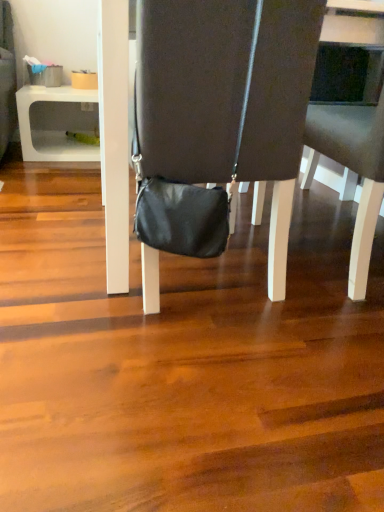
Measure the distance between white plastic table at lower left and camera.

The distance of white plastic table at lower left from camera is 7.23 feet.

What is the approximate height of white plastic table at lower left?

It is 15.27 inches.

This screenshot has width=384, height=512. I want to click on dark gray fabric chair at center, acting as the 2th chair starting from the left, so click(x=352, y=170).

Which is more to the left, dark gray fabric chair at center, acting as the 2th chair starting from the left, or matte black bag at center, the 2th chair positioned from the right?

matte black bag at center, the 2th chair positioned from the right, is more to the left.

From the picture: Is dark gray fabric chair at center, acting as the 2th chair starting from the left, positioned with its back to matte black bag at center, the 2th chair positioned from the right?

No.

Is point (256, 209) in front of point (232, 38)?

No, (256, 209) is further to viewer.

From the image's perspective, is dark gray fabric chair at center, the first chair from the right, beneath matte black bag at center, marked as the first chair in a left-to-right arrangement?

No, from the image's perspective, dark gray fabric chair at center, the first chair from the right, is not beneath matte black bag at center, marked as the first chair in a left-to-right arrangement.

In the scene shown: Which is closer, (33, 160) or (323, 31)?

Point (33, 160) appears to be farther away from the viewer than point (323, 31).

Could you tell me if white plastic table at lower left is facing dark gray fabric chair at center, acting as the 2th chair starting from the left?

No, white plastic table at lower left is not aimed at dark gray fabric chair at center, acting as the 2th chair starting from the left.

Is white plastic table at lower left positioned far away from dark gray fabric chair at center, acting as the 2th chair starting from the left?

Yes, white plastic table at lower left and dark gray fabric chair at center, acting as the 2th chair starting from the left, are quite far apart.

Where is `table below the dark gray fabric chair at center, acting as the 2th chair starting from the left (from a real-world perspective)`? The height and width of the screenshot is (512, 384). table below the dark gray fabric chair at center, acting as the 2th chair starting from the left (from a real-world perspective) is located at coordinates (56, 123).

In the scene shown: What's the angular difference between dark gray fabric chair at center, acting as the 2th chair starting from the left, and white plastic table at lower left's facing directions?

180 degrees separate the facing orientations of dark gray fabric chair at center, acting as the 2th chair starting from the left, and white plastic table at lower left.

From a real-world perspective, which object stands above the other?

dark gray fabric chair at center, the first chair from the right, from a real-world perspective.

In the scene shown: From the image's perspective, is dark gray fabric chair at center, acting as the 2th chair starting from the left, located above white plastic table at lower left?

Incorrect, from the image's perspective, dark gray fabric chair at center, acting as the 2th chair starting from the left, is lower than white plastic table at lower left.

Does dark gray fabric chair at center, the first chair from the right, have a greater width compared to white plastic table at lower left?

No, dark gray fabric chair at center, the first chair from the right, is not wider than white plastic table at lower left.

Is matte black bag at center, the 2th chair positioned from the right, situated inside white plastic table at lower left or outside?

matte black bag at center, the 2th chair positioned from the right, lies outside white plastic table at lower left.

Between matte black bag at center, marked as the first chair in a left-to-right arrangement, and white plastic table at lower left, which one has larger width?

white plastic table at lower left.

From a real-world perspective, is matte black bag at center, marked as the first chair in a left-to-right arrangement, positioned above or below white plastic table at lower left?

In terms of real-world spatial position, matte black bag at center, marked as the first chair in a left-to-right arrangement, is above white plastic table at lower left.

Is matte black bag at center, the 2th chair positioned from the right, oriented away from white plastic table at lower left?

matte black bag at center, the 2th chair positioned from the right, does not have its back to white plastic table at lower left.

Consider the image. From the image's perspective, would you say matte black bag at center, marked as the first chair in a left-to-right arrangement, is shown under dark gray fabric chair at center, acting as the 2th chair starting from the left?

Correct, matte black bag at center, marked as the first chair in a left-to-right arrangement, appears lower than dark gray fabric chair at center, acting as the 2th chair starting from the left, in the image.

Is matte black bag at center, the 2th chair positioned from the right, bigger or smaller than dark gray fabric chair at center, acting as the 2th chair starting from the left?

matte black bag at center, the 2th chair positioned from the right, is bigger than dark gray fabric chair at center, acting as the 2th chair starting from the left.

From a real-world perspective, is matte black bag at center, the 2th chair positioned from the right, positioned under dark gray fabric chair at center, acting as the 2th chair starting from the left, based on gravity?

Yes, from a real-world perspective, matte black bag at center, the 2th chair positioned from the right, is beneath dark gray fabric chair at center, acting as the 2th chair starting from the left.

Does white plastic table at lower left contain matte black bag at center, marked as the first chair in a left-to-right arrangement?

No, matte black bag at center, marked as the first chair in a left-to-right arrangement, is located outside of white plastic table at lower left.

In order to click on table behind the matte black bag at center, marked as the first chair in a left-to-right arrangement in this screenshot , I will do `click(56, 123)`.

Is white plastic table at lower left shorter than matte black bag at center, the 2th chair positioned from the right?

Yes, white plastic table at lower left is shorter than matte black bag at center, the 2th chair positioned from the right.

From the image's perspective, which is below, white plastic table at lower left or matte black bag at center, marked as the first chair in a left-to-right arrangement?

matte black bag at center, marked as the first chair in a left-to-right arrangement, appears lower in the image.

What are the coordinates of `chair below the dark gray fabric chair at center, the first chair from the right (from a real-world perspective)` in the screenshot? It's located at pos(217,122).

Where is `chair that is the 2nd object to the right of the white plastic table at lower left, starting at the anchor`? This screenshot has height=512, width=384. chair that is the 2nd object to the right of the white plastic table at lower left, starting at the anchor is located at coordinates (352, 170).

From the image, which object appears to be farther from white plastic table at lower left, dark gray fabric chair at center, acting as the 2th chair starting from the left, or matte black bag at center, the 2th chair positioned from the right?

Based on the image, dark gray fabric chair at center, acting as the 2th chair starting from the left, appears to be further to white plastic table at lower left.

From the image, which object appears to be farther from matte black bag at center, the 2th chair positioned from the right, dark gray fabric chair at center, acting as the 2th chair starting from the left, or white plastic table at lower left?

white plastic table at lower left.

When comparing their distances from dark gray fabric chair at center, acting as the 2th chair starting from the left, does white plastic table at lower left or matte black bag at center, marked as the first chair in a left-to-right arrangement, seem further?

white plastic table at lower left lies further to dark gray fabric chair at center, acting as the 2th chair starting from the left, than the other object.

Which object lies nearer to the anchor point dark gray fabric chair at center, acting as the 2th chair starting from the left, matte black bag at center, marked as the first chair in a left-to-right arrangement, or white plastic table at lower left?

matte black bag at center, marked as the first chair in a left-to-right arrangement, is closer to dark gray fabric chair at center, acting as the 2th chair starting from the left.

Looking at the image, which one is located closer to white plastic table at lower left, matte black bag at center, marked as the first chair in a left-to-right arrangement, or dark gray fabric chair at center, the first chair from the right?

matte black bag at center, marked as the first chair in a left-to-right arrangement, lies closer to white plastic table at lower left than the other object.

From the image, which object appears to be nearer to matte black bag at center, the 2th chair positioned from the right, white plastic table at lower left or dark gray fabric chair at center, acting as the 2th chair starting from the left?

Among the two, dark gray fabric chair at center, acting as the 2th chair starting from the left, is located nearer to matte black bag at center, the 2th chair positioned from the right.

The width and height of the screenshot is (384, 512). Identify the location of chair between matte black bag at center, marked as the first chair in a left-to-right arrangement, and white plastic table at lower left in the front-back direction. (352, 170).